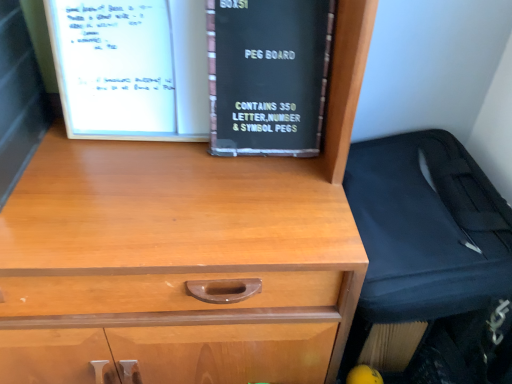
Question: In the image, is black cardboard box at center on the left side or the right side of black fabric suitcase at right?

Choices:
 (A) right
 (B) left

Answer: (B)

Question: Is black cardboard box at center bigger or smaller than black fabric suitcase at right?

Choices:
 (A) big
 (B) small

Answer: (B)

Question: From a real-world perspective, is black cardboard box at center positioned above or below black fabric suitcase at right?

Choices:
 (A) below
 (B) above

Answer: (B)

Question: Looking at the image, does black fabric suitcase at right seem bigger or smaller compared to black cardboard box at center?

Choices:
 (A) small
 (B) big

Answer: (B)

Question: In terms of height, does black fabric suitcase at right look taller or shorter compared to black cardboard box at center?

Choices:
 (A) tall
 (B) short

Answer: (A)

Question: Considering the relative positions of black fabric suitcase at right and black cardboard box at center in the image provided, is black fabric suitcase at right to the left or to the right of black cardboard box at center?

Choices:
 (A) left
 (B) right

Answer: (B)

Question: Which is correct: black fabric suitcase at right is inside black cardboard box at center, or outside of it?

Choices:
 (A) outside
 (B) inside

Answer: (A)